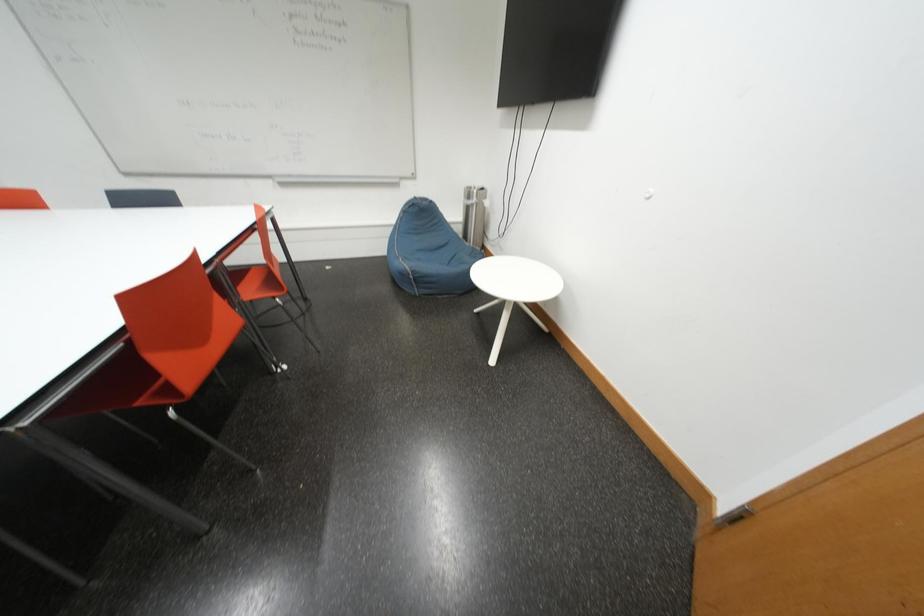
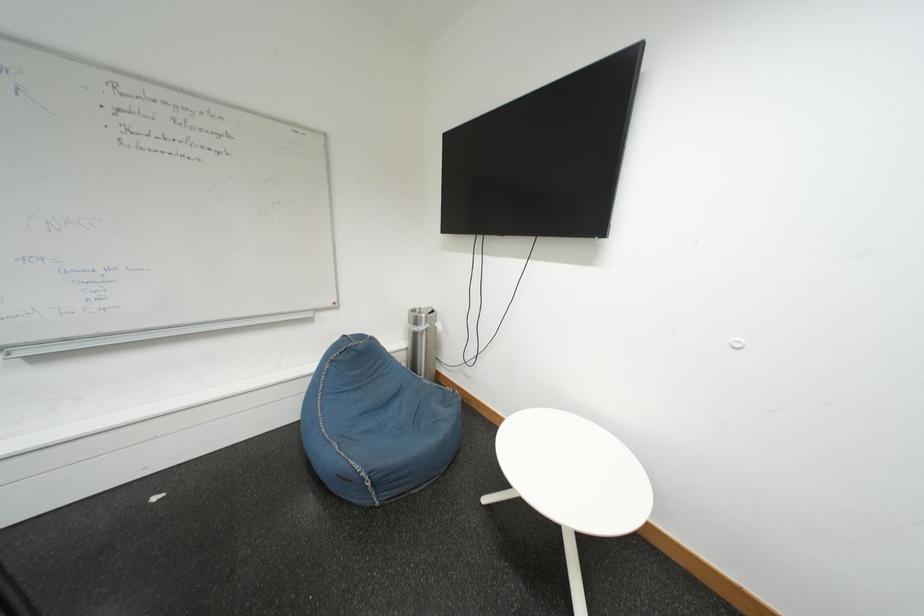
First-person continuous shooting, in which direction is the camera rotating?

The camera rotated toward right-up.